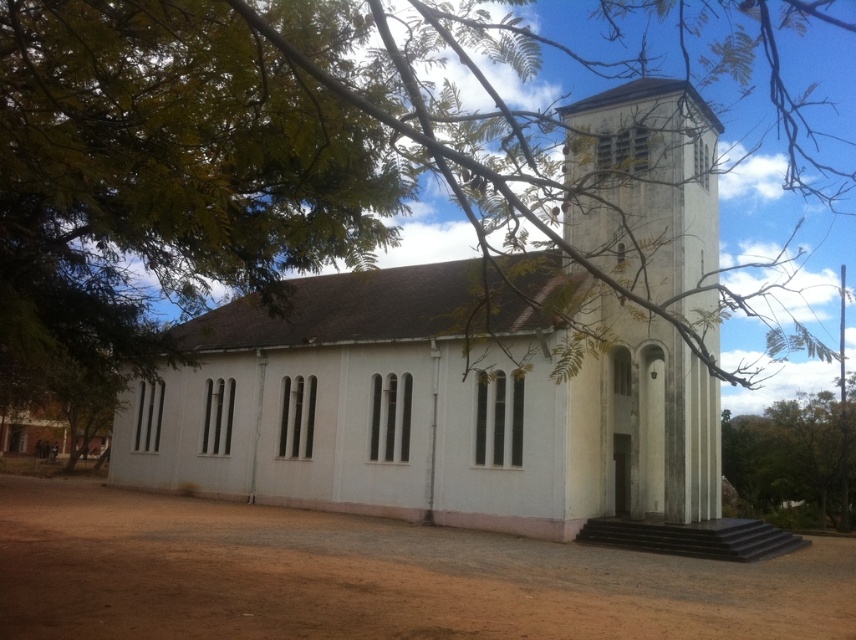
Does white concrete church at center appear over green leafy tree at lower right?

Yes, white concrete church at center is above green leafy tree at lower right.

Describe the element at coordinates (426, 412) in the screenshot. The height and width of the screenshot is (640, 856). I see `white concrete church at center` at that location.

The width and height of the screenshot is (856, 640). Find the location of `white concrete church at center`. white concrete church at center is located at coordinates (426, 412).

Who is more distant from viewer, (542, 401) or (417, 616)?

The point (542, 401) is behind.

Is white concrete church at center bigger than brown dirt field at lower left?

Yes.

The image size is (856, 640). Describe the element at coordinates (426, 412) in the screenshot. I see `white concrete church at center` at that location.

I want to click on white concrete church at center, so click(426, 412).

Between brown dirt field at lower left and green leafy tree at lower right, which one has more height?

green leafy tree at lower right

Is brown dirt field at lower left wider than green leafy tree at lower right?

Yes, brown dirt field at lower left is wider than green leafy tree at lower right.

Between point (336, 561) and point (827, 449), which one is positioned in front?

Positioned in front is point (336, 561).

Locate an element on the screen. brown dirt field at lower left is located at coordinates (372, 579).